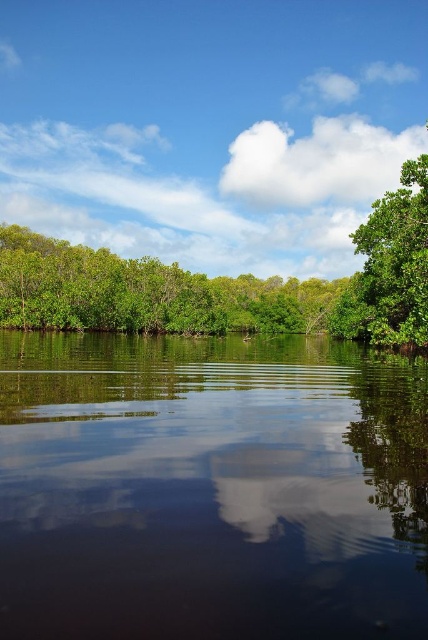
Is point (116, 554) behind point (407, 280)?

No.

Is point (278, 618) in front of point (392, 272)?

Yes.

You are a GUI agent. You are given a task and a screenshot of the screen. Output one action in this format:
    pyautogui.click(x=<x>, y=<y>)
    Task: Click on the dark reflective water at center
    The width and height of the screenshot is (428, 640).
    Given the screenshot: What is the action you would take?
    pyautogui.click(x=211, y=488)

Is dark reflective water at center shorter than green leafy trees at left?

Yes, dark reflective water at center is shorter than green leafy trees at left.

Can you confirm if dark reflective water at center is positioned to the right of green leafy trees at left?

Correct, you'll find dark reflective water at center to the right of green leafy trees at left.

Which is in front, point (92, 573) or point (77, 310)?

Point (92, 573)

Find the location of a particular element. dark reflective water at center is located at coordinates (211, 488).

Is green leafy trees at left positioned before green matte tree at right?

No, it is behind green matte tree at right.

You are a GUI agent. You are given a task and a screenshot of the screen. Output one action in this format:
    pyautogui.click(x=<x>, y=<y>)
    Task: Click on the green leafy trees at left
    
    Given the screenshot: What is the action you would take?
    pyautogui.click(x=145, y=292)

Where is `green leafy trees at left`? This screenshot has height=640, width=428. green leafy trees at left is located at coordinates (145, 292).